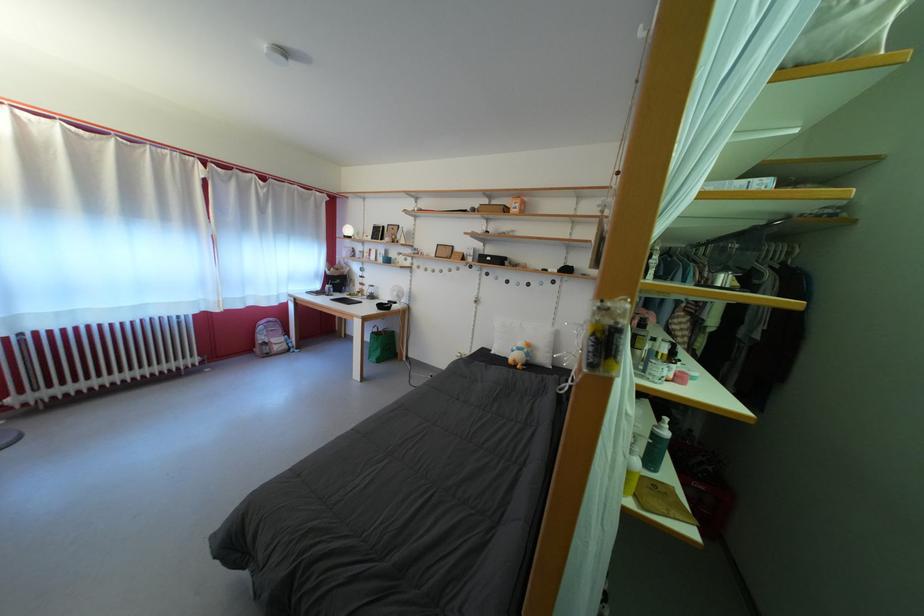
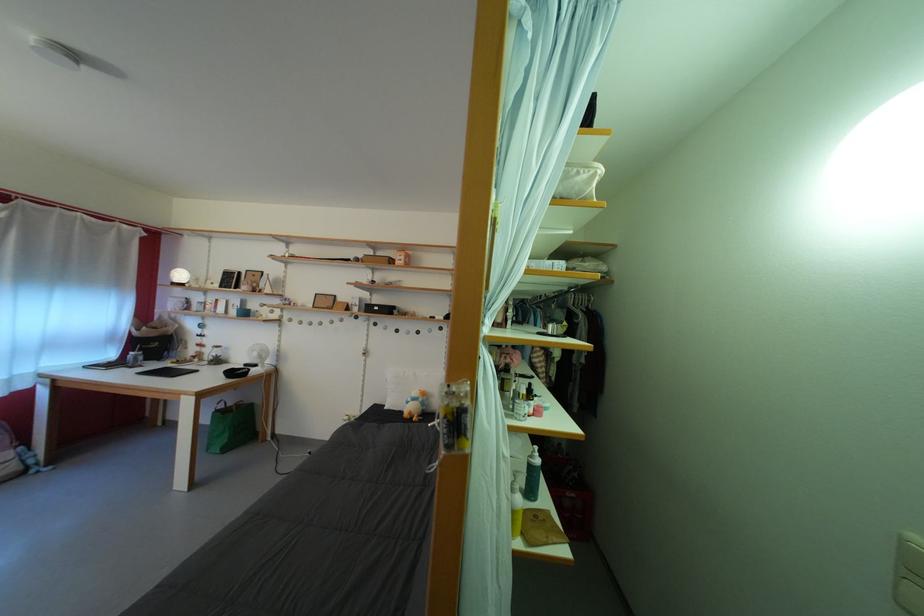
Where in the second image is the point corresponding to (496,265) from the first image?

(384, 314)